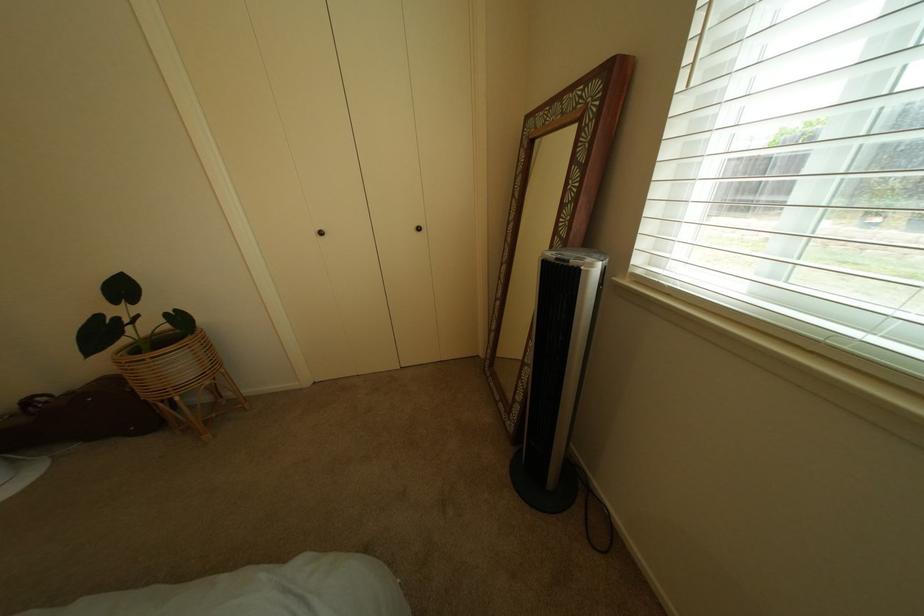
The image size is (924, 616). Describe the element at coordinates (28, 468) in the screenshot. I see `a white blind cord` at that location.